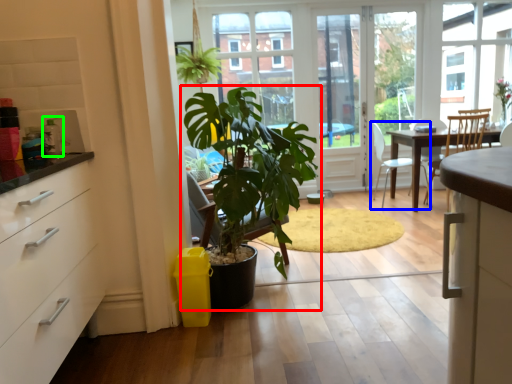
Question: Which is nearer to the houseplant (highlighted by a red box)? chair (highlighted by a blue box) or appliance (highlighted by a green box).

Choices:
 (A) chair
 (B) appliance

Answer: (B)